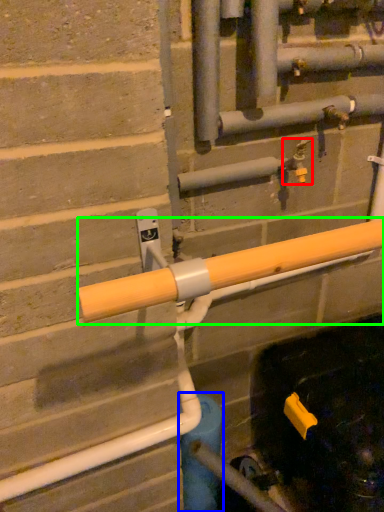
Question: Which is farther away from plumbing fixture (highlighted by a red box)? water pipe (highlighted by a blue box) or beam (highlighted by a green box)?

Choices:
 (A) water pipe
 (B) beam

Answer: (A)